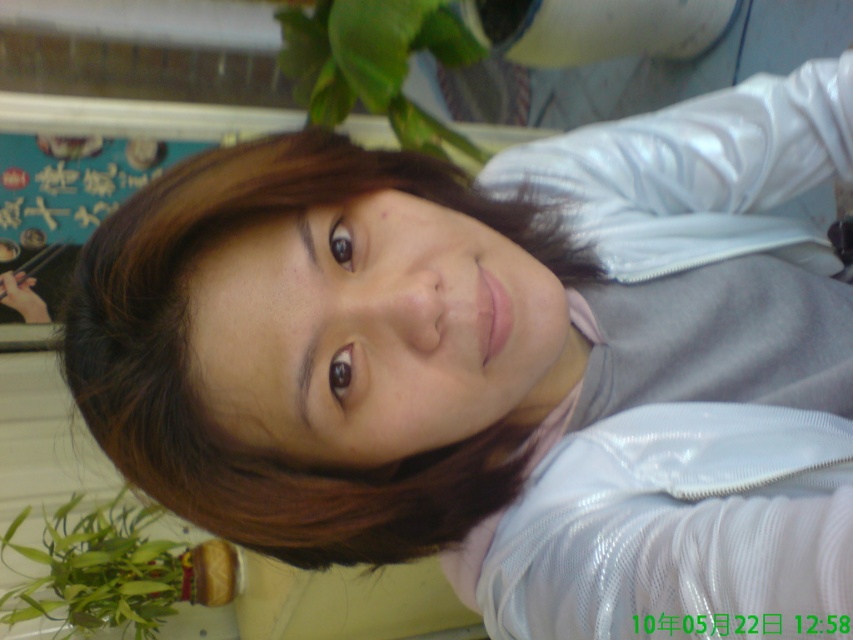
Is brown shiny hair at upper center below green leafy plant at upper center?

Yes, brown shiny hair at upper center is below green leafy plant at upper center.

Who is positioned more to the left, brown shiny hair at upper center or green leafy plant at upper center?

Positioned to the left is green leafy plant at upper center.

Is point (154, 256) farther from viewer compared to point (393, 90)?

No, it is in front of (393, 90).

You are a GUI agent. You are given a task and a screenshot of the screen. Output one action in this format:
    pyautogui.click(x=<x>, y=<y>)
    Task: Click on the brown shiny hair at upper center
    The width and height of the screenshot is (853, 640).
    Given the screenshot: What is the action you would take?
    pyautogui.click(x=190, y=387)

Is green leafy plant at upper center to the right of green leafy plant at lower left from the viewer's perspective?

Yes, green leafy plant at upper center is to the right of green leafy plant at lower left.

Can you confirm if green leafy plant at upper center is smaller than green leafy plant at lower left?

Actually, green leafy plant at upper center might be larger than green leafy plant at lower left.

Consider the image. Who is more distant from viewer, (x=422, y=6) or (x=125, y=573)?

Point (x=125, y=573)

Locate an element on the screen. The height and width of the screenshot is (640, 853). green leafy plant at upper center is located at coordinates (373, 61).

Is point (527, 236) farther from camera compared to point (148, 512)?

No, it is in front of (148, 512).

Which is more to the left, brown shiny hair at upper center or green leafy plant at lower left?

From the viewer's perspective, green leafy plant at lower left appears more on the left side.

Is point (283, 188) closer to viewer compared to point (57, 576)?

Yes.

Identify the location of brown shiny hair at upper center. The height and width of the screenshot is (640, 853). (190, 387).